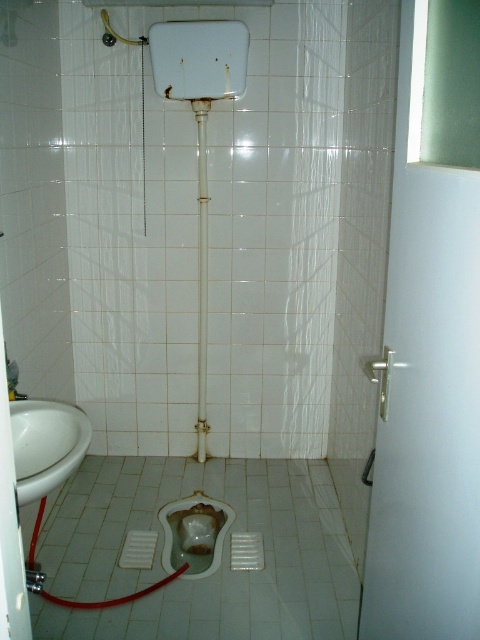
Question: Is matte white toilet bowl at center closer to the viewer compared to metallic pipe at center?

Choices:
 (A) no
 (B) yes

Answer: (B)

Question: Which object appears closest to the camera in this image?

Choices:
 (A) white glossy sink at left
 (B) matte white toilet bowl at center
 (C) metallic pipe at center
 (D) metallic silver shower head at upper left

Answer: (A)

Question: Which point is closer to the camera?

Choices:
 (A) (207, 566)
 (B) (60, 440)
 (C) (140, 44)

Answer: (B)

Question: Which of the following is the farthest from the observer?

Choices:
 (A) metallic silver shower head at upper left
 (B) metallic pipe at center

Answer: (B)

Question: Does metallic pipe at center have a smaller size compared to metallic silver shower head at upper left?

Choices:
 (A) no
 (B) yes

Answer: (A)

Question: Is white glossy sink at left wider than metallic silver shower head at upper left?

Choices:
 (A) no
 (B) yes

Answer: (B)